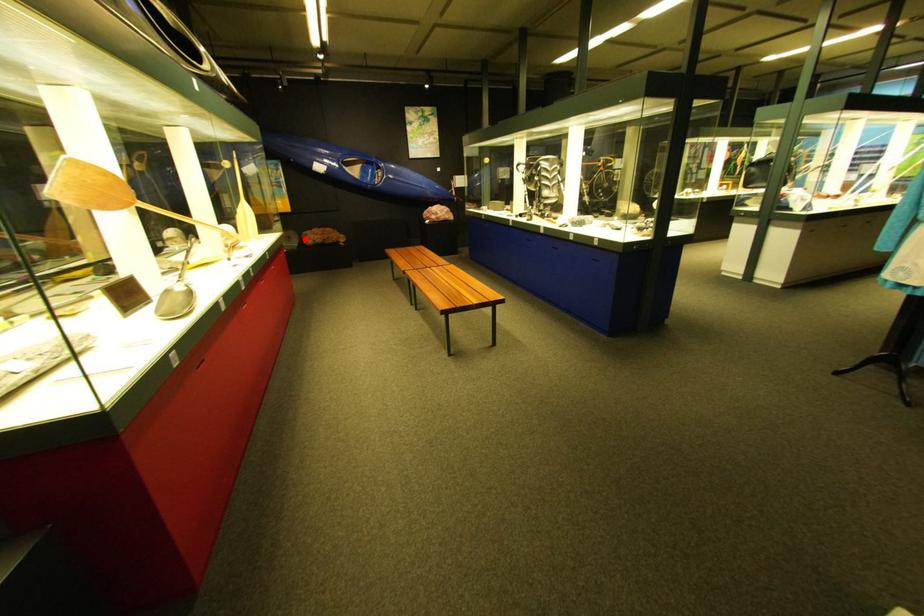
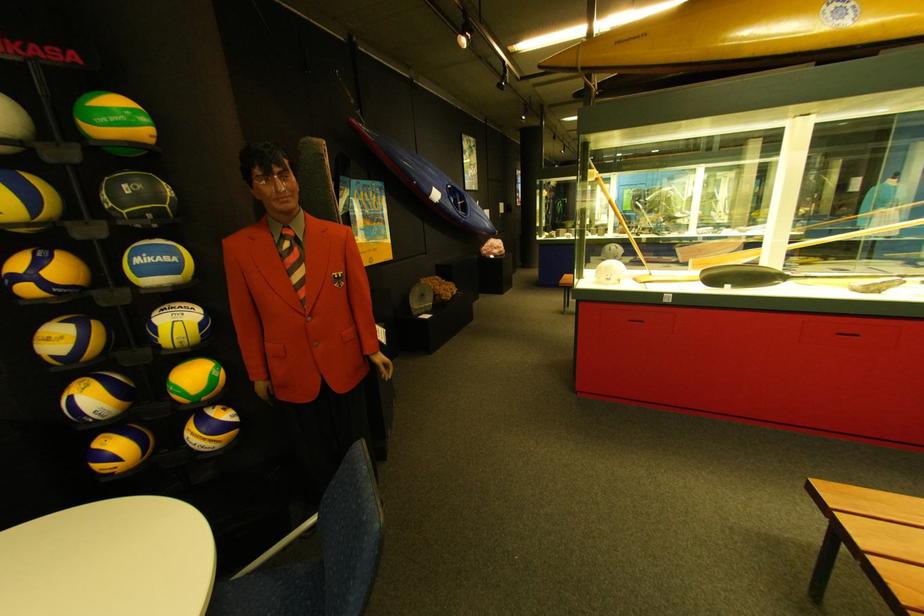
Question: I am providing you with two images of the same scene from different viewpoints. In image1, a red point is highlighted. Considering the same 3D point in image2, which of the following is correct?

Choices:
 (A) It is closer
 (B) It is farther

Answer: (B)